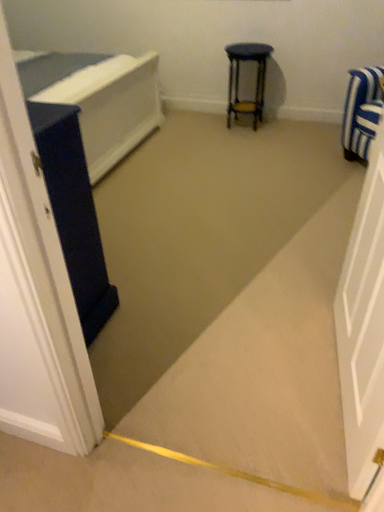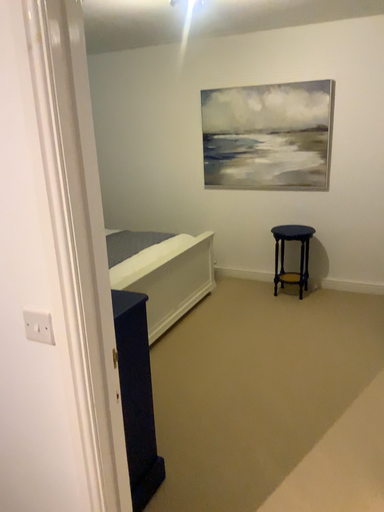
Question: How did the camera likely rotate when shooting the video?

Choices:
 (A) rotated upward
 (B) rotated downward

Answer: (A)